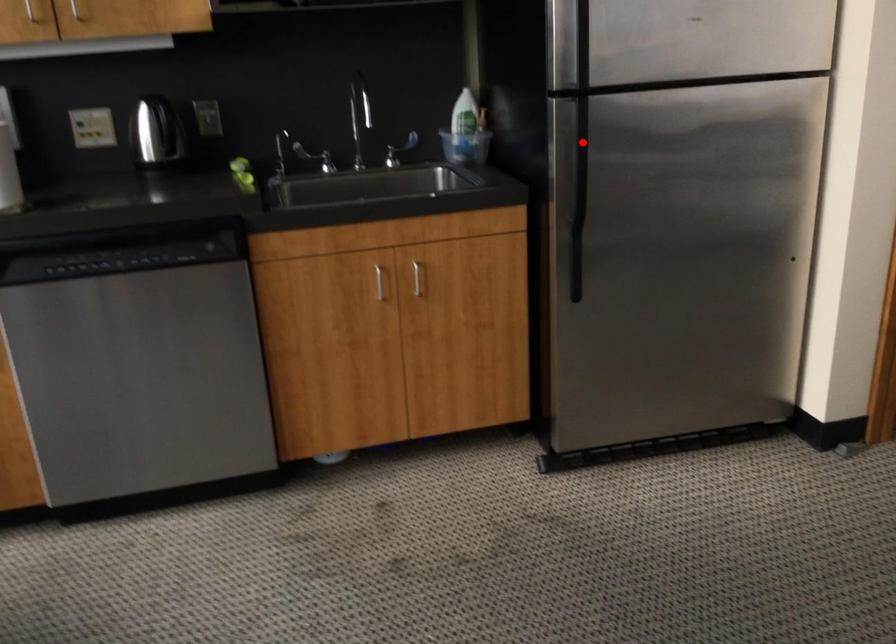
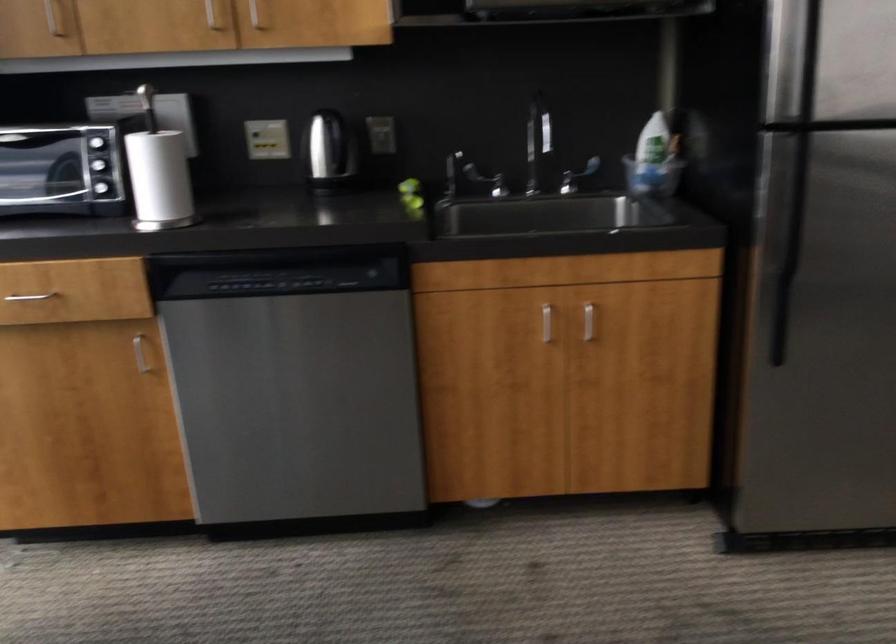
Question: A red point is marked in image1. In image2, is the corresponding 3D point closer to the camera or farther? Reply with the corresponding letter.

Choices:
 (A) The corresponding 3D point is closer.
 (B) The corresponding 3D point is farther.

Answer: (A)